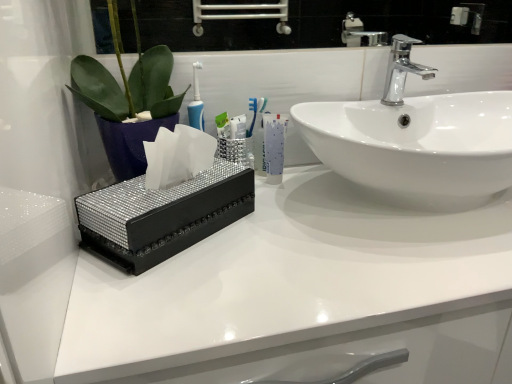
Question: Does white glossy sink at center have a lesser height compared to polished chrome faucet at upper right?

Choices:
 (A) yes
 (B) no

Answer: (B)

Question: Can we say white glossy sink at center lies outside polished chrome faucet at upper right?

Choices:
 (A) no
 (B) yes

Answer: (B)

Question: Is white glossy sink at center closer to the viewer compared to polished chrome faucet at upper right?

Choices:
 (A) no
 (B) yes

Answer: (B)

Question: Would you say polished chrome faucet at upper right is part of white glossy sink at center's contents?

Choices:
 (A) no
 (B) yes

Answer: (A)

Question: Does white glossy sink at center appear on the left side of polished chrome faucet at upper right?

Choices:
 (A) no
 (B) yes

Answer: (A)

Question: In terms of height, does black glossy tissue box at center look taller or shorter compared to white glossy mouthwash at center?

Choices:
 (A) tall
 (B) short

Answer: (A)

Question: Is black glossy tissue box at center bigger or smaller than white glossy mouthwash at center?

Choices:
 (A) small
 (B) big

Answer: (B)

Question: From a real-world perspective, is black glossy tissue box at center physically located above or below white glossy mouthwash at center?

Choices:
 (A) below
 (B) above

Answer: (A)

Question: Is point (241, 283) positioned closer to the camera than point (273, 122)?

Choices:
 (A) closer
 (B) farther

Answer: (A)

Question: In the image, is sparkly black tissue box at center positioned in front of or behind white glossy sink at center?

Choices:
 (A) front
 (B) behind

Answer: (A)

Question: Would you say sparkly black tissue box at center is to the left or to the right of white glossy sink at center in the picture?

Choices:
 (A) right
 (B) left

Answer: (B)

Question: From their relative heights in the image, would you say sparkly black tissue box at center is taller or shorter than white glossy sink at center?

Choices:
 (A) short
 (B) tall

Answer: (A)

Question: Is point (111, 253) closer or farther from the camera than point (449, 145)?

Choices:
 (A) closer
 (B) farther

Answer: (A)

Question: Is black glossy tissue box at center to the left or to the right of polished chrome faucet at upper right in the image?

Choices:
 (A) right
 (B) left

Answer: (A)

Question: From a real-world perspective, is black glossy tissue box at center positioned above or below polished chrome faucet at upper right?

Choices:
 (A) above
 (B) below

Answer: (B)